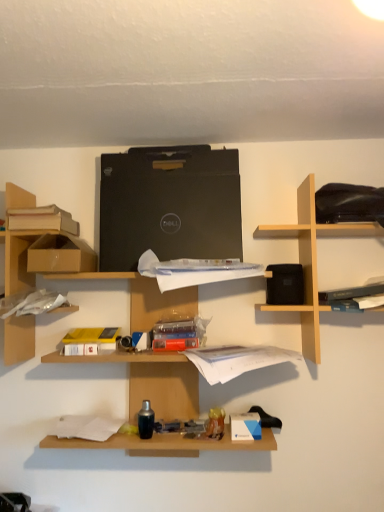
Question: From the image's perspective, relative to white paper at center, the second book positioned from the right, is hardcover book at upper right, acting as the 3th book starting from the left, above or below?

Choices:
 (A) above
 (B) below

Answer: (A)

Question: Is hardcover book at upper right, the second book ordered from the bottom, situated inside white paper at center, positioned as the 1th book in bottom-to-top order, or outside?

Choices:
 (A) outside
 (B) inside

Answer: (A)

Question: Which object is positioned farthest from the matte cardboard book at upper left, the 1th book from the left?

Choices:
 (A) black matte laptop at center
 (B) hardcover book at upper right, which is counted as the 1th book, starting from the right
 (C) light wood/black speaker at upper right, the second shelf viewed from the left
 (D) brown cardboard boxes at left, the second shelf when ordered from right to left
 (E) white paper at center, the second book positioned from the right

Answer: (B)

Question: Estimate the real-world distances between objects in this image. Which object is farther from the brown cardboard boxes at left, the 1th shelf positioned from the left?

Choices:
 (A) hardcover book at upper right, which appears as the 2th book when viewed from the top
 (B) brown cardboard box at left
 (C) matte cardboard book at upper left, marked as the third book in a bottom-to-top arrangement
 (D) black matte laptop at center
 (E) white paper at center, which is counted as the second book, starting from the left

Answer: (A)